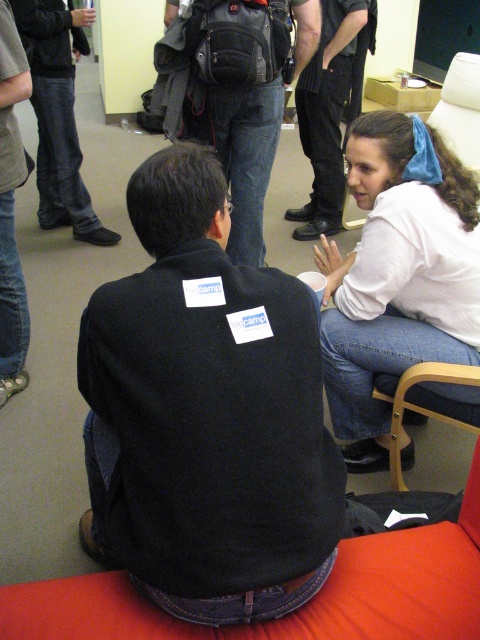
Which is above, red fabric swivel chair at lower center or black fleece jacket at lower left?

black fleece jacket at lower left is higher up.

Between red fabric swivel chair at lower center and black fleece jacket at lower left, which one is positioned lower?

red fabric swivel chair at lower center is below.

This screenshot has width=480, height=640. What do you see at coordinates (303, 605) in the screenshot?
I see `red fabric swivel chair at lower center` at bounding box center [303, 605].

This screenshot has width=480, height=640. I want to click on red fabric swivel chair at lower center, so click(x=303, y=605).

Can you confirm if white cotton shirt at upper right is smaller than jeans at left?

Yes.

Is point (359, 252) more distant than point (44, 195)?

No, it is not.

This screenshot has width=480, height=640. I want to click on white cotton shirt at upper right, so click(397, 275).

Does red fabric swivel chair at lower center have a lesser width compared to jeans at left?

No, red fabric swivel chair at lower center is not thinner than jeans at left.

Between red fabric swivel chair at lower center and jeans at left, which one has less height?

With less height is red fabric swivel chair at lower center.

The width and height of the screenshot is (480, 640). Find the location of `red fabric swivel chair at lower center`. red fabric swivel chair at lower center is located at coordinates (303, 605).

Where is `red fabric swivel chair at lower center`? red fabric swivel chair at lower center is located at coordinates (303, 605).